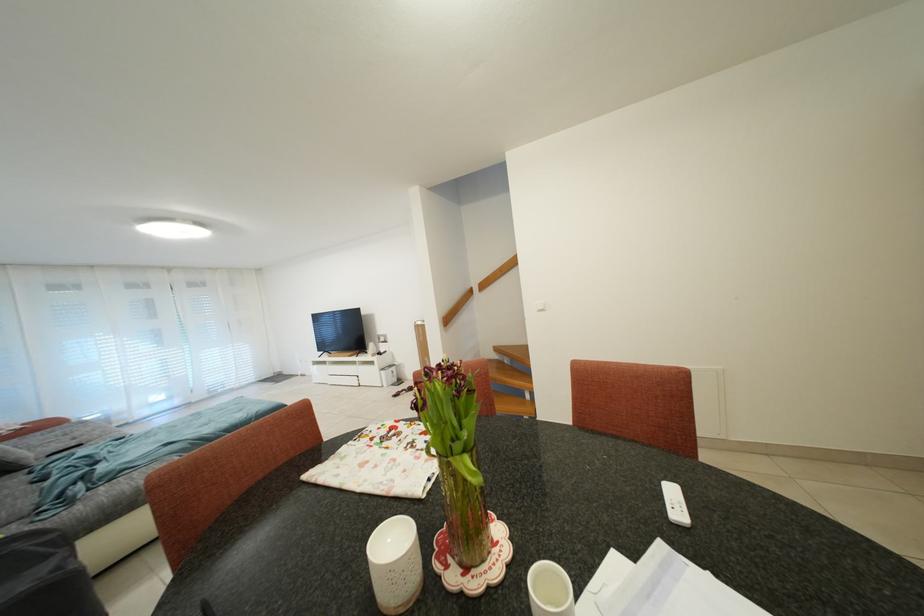
The image size is (924, 616). I want to click on white candle holder, so click(x=395, y=564).